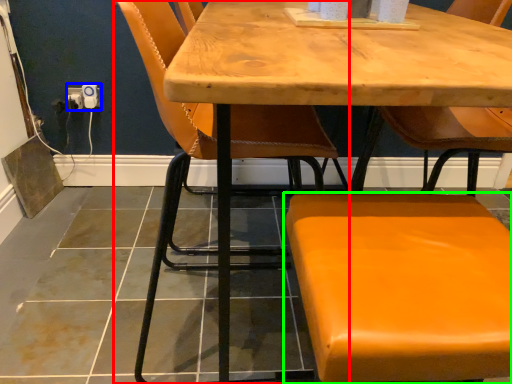
Question: Which object is positioned farthest from chair (highlighted by a red box)? Select from electric outlet (highlighted by a blue box) and chair (highlighted by a green box).

Choices:
 (A) electric outlet
 (B) chair

Answer: (B)